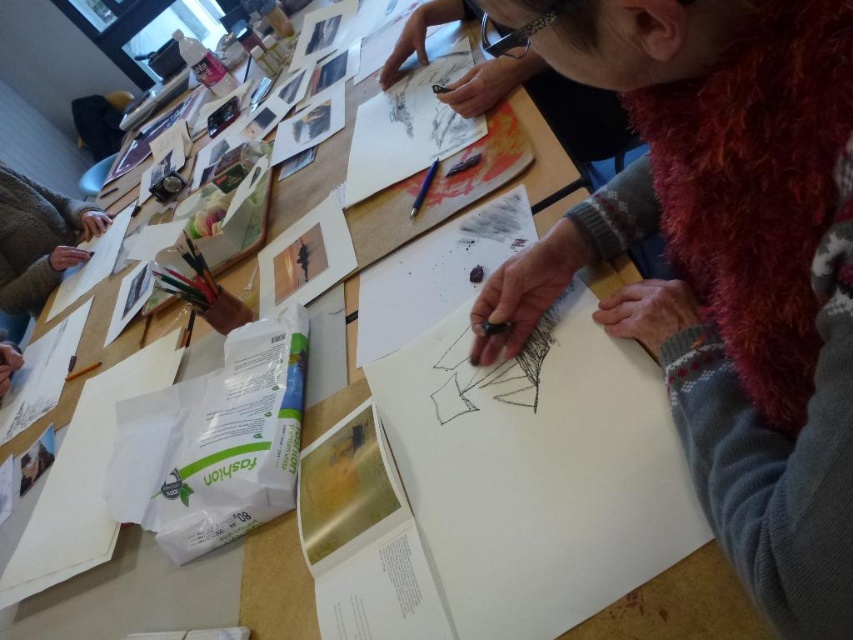
What are the coordinates of the white paper at center?

The white paper at center is located at coordinates point (408,128).

You are an art student who needs to know if the white paper at center can fit the blue metallic pencil at center horizontally. Can it?

The white paper at center is wider than the blue metallic pencil at center, so yes, the blue metallic pencil at center can fit horizontally on the white paper at center.